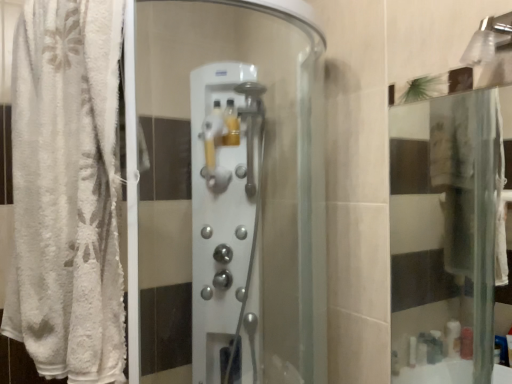
Question: Does point (248, 352) appear closer or farther from the camera than point (52, 196)?

Choices:
 (A) farther
 (B) closer

Answer: (A)

Question: Based on their sizes in the image, would you say satin silver shower controls at center is bigger or smaller than white fluffy towel at left?

Choices:
 (A) small
 (B) big

Answer: (A)

Question: Is satin silver shower controls at center to the left or to the right of white fluffy towel at left in the image?

Choices:
 (A) right
 (B) left

Answer: (A)

Question: From the image's perspective, is white fluffy towel at left above or below satin silver shower controls at center?

Choices:
 (A) above
 (B) below

Answer: (A)

Question: Is white fluffy towel at left wider or thinner than satin silver shower controls at center?

Choices:
 (A) thin
 (B) wide

Answer: (A)

Question: Is white fluffy towel at left situated inside satin silver shower controls at center or outside?

Choices:
 (A) outside
 (B) inside

Answer: (A)

Question: In terms of height, does white fluffy towel at left look taller or shorter compared to satin silver shower controls at center?

Choices:
 (A) tall
 (B) short

Answer: (B)